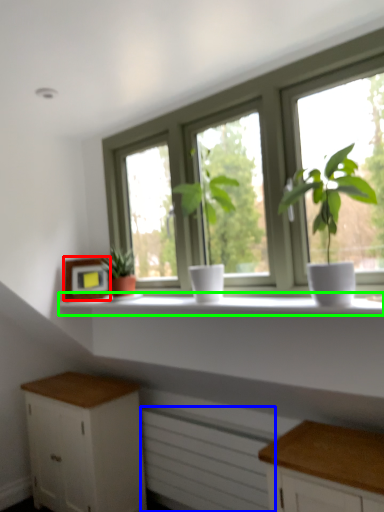
Question: Which object is the farthest from picture frame (highlighted by a red box)? Choose among these: radiator (highlighted by a blue box) or window sill (highlighted by a green box).

Choices:
 (A) radiator
 (B) window sill

Answer: (A)